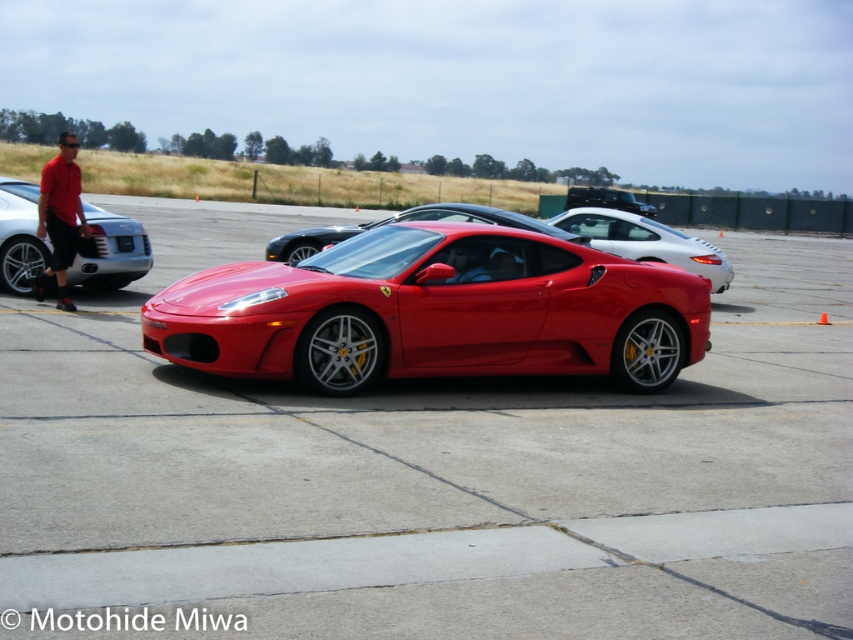
The image size is (853, 640). Describe the element at coordinates (428, 474) in the screenshot. I see `glossy asphalt tarmac at center` at that location.

Who is shorter, glossy asphalt tarmac at center or shiny silver car at left?

shiny silver car at left is shorter.

Between point (167, 509) and point (83, 262), which one is positioned in front?

Point (167, 509) is more forward.

You are a GUI agent. You are given a task and a screenshot of the screen. Output one action in this format:
    pyautogui.click(x=<x>, y=<y>)
    Task: Click on the glossy asphalt tarmac at center
    This screenshot has height=640, width=853.
    Given the screenshot: What is the action you would take?
    pyautogui.click(x=428, y=474)

The width and height of the screenshot is (853, 640). What do you see at coordinates (428, 474) in the screenshot?
I see `glossy asphalt tarmac at center` at bounding box center [428, 474].

Is glossy asphalt tarmac at center smaller than shiny red ferrari at center?

No, glossy asphalt tarmac at center is not smaller than shiny red ferrari at center.

Locate an element on the screen. glossy asphalt tarmac at center is located at coordinates (428, 474).

You are a GUI agent. You are given a task and a screenshot of the screen. Output one action in this format:
    pyautogui.click(x=<x>, y=<y>)
    Task: Click on the glossy asphalt tarmac at center
    
    Given the screenshot: What is the action you would take?
    pyautogui.click(x=428, y=474)

Who is more forward, (257, 260) or (51, 256)?

Point (257, 260) is in front.

Which is more to the right, shiny red ferrari at center or matte red shirt at left?

From the viewer's perspective, shiny red ferrari at center appears more on the right side.

Describe the element at coordinates (434, 310) in the screenshot. I see `shiny red ferrari at center` at that location.

You are a GUI agent. You are given a task and a screenshot of the screen. Output one action in this format:
    pyautogui.click(x=<x>, y=<y>)
    Task: Click on the shiny red ferrari at center
    
    Given the screenshot: What is the action you would take?
    pyautogui.click(x=434, y=310)